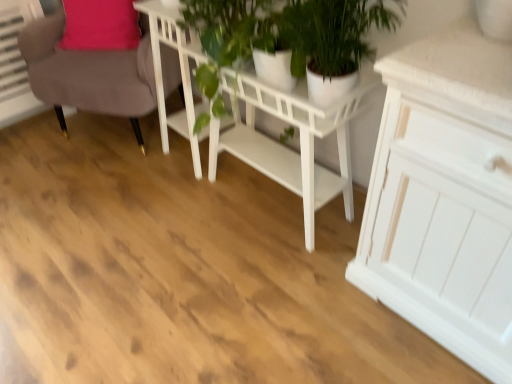
Find the location of a particular element. The width and height of the screenshot is (512, 384). free space in front of white wooden table at center, placed as the second table when sorted from right to left is located at coordinates (178, 194).